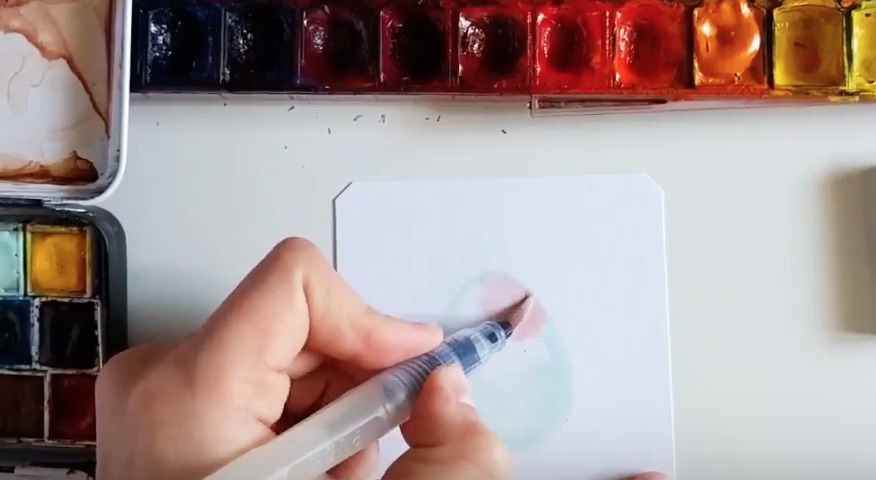
The image size is (876, 480). Identify the location of purple paint. (252, 58).